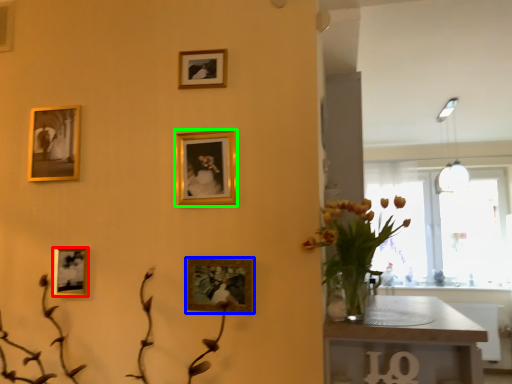
Question: Which is nearer to the picture frame (highlighted by a red box)? picture frame (highlighted by a blue box) or picture frame (highlighted by a green box).

Choices:
 (A) picture frame
 (B) picture frame

Answer: (A)